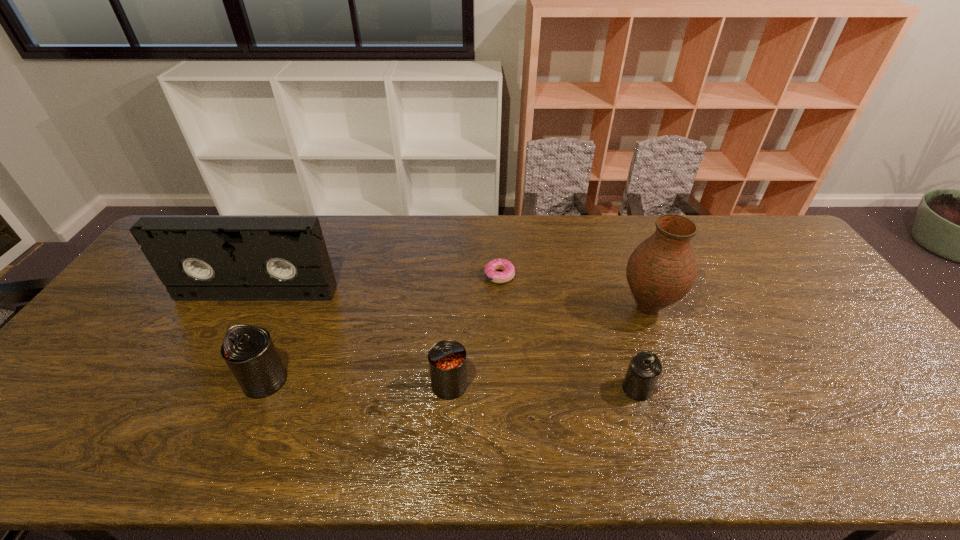
Locate an element on the screen. The image size is (960, 540). the tallest can is located at coordinates (249, 351).

This screenshot has width=960, height=540. What are the coordinates of `the leftmost can` in the screenshot? It's located at (249, 351).

The image size is (960, 540). I want to click on the fourth object from right to left, so click(447, 359).

You are a GUI agent. You are given a task and a screenshot of the screen. Output one action in this format:
    pyautogui.click(x=<x>, y=<y>)
    Task: Click on the second shortest can
    The width and height of the screenshot is (960, 540).
    Given the screenshot: What is the action you would take?
    pyautogui.click(x=447, y=359)

Where is `the shortest can`? The height and width of the screenshot is (540, 960). the shortest can is located at coordinates (644, 369).

The width and height of the screenshot is (960, 540). Find the location of `the rightmost can`. the rightmost can is located at coordinates tap(644, 369).

Where is `the farthest object`? The image size is (960, 540). the farthest object is located at coordinates (507, 267).

This screenshot has width=960, height=540. Identify the location of doughnut. (507, 267).

This screenshot has height=540, width=960. What are the coordinates of `videotape` in the screenshot? It's located at (197, 258).

At what (x,y) coordinates should I click in order to perform the action: click on vase. Please return your answer as a coordinate pair (x, y). The width and height of the screenshot is (960, 540). Looking at the image, I should click on (661, 270).